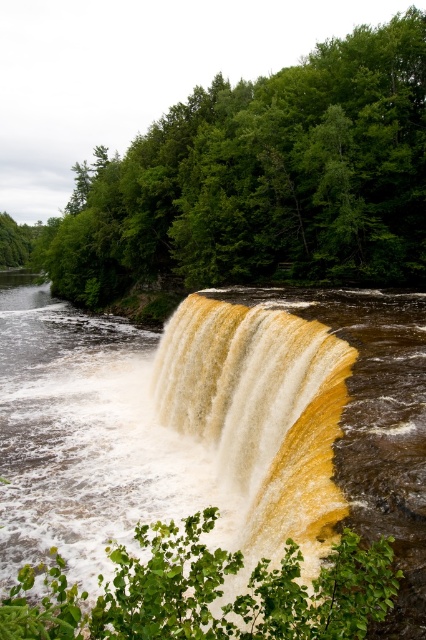
Question: Estimate the real-world distances between objects in this image. Which object is closer to the yellowish water at center?

Choices:
 (A) green leafy trees at center
 (B) brown textured waterfall at center

Answer: (B)

Question: Does brown textured waterfall at center come in front of green leafy trees at center?

Choices:
 (A) no
 (B) yes

Answer: (B)

Question: Does brown textured waterfall at center have a lesser width compared to yellowish water at center?

Choices:
 (A) yes
 (B) no

Answer: (B)

Question: Which object is positioned farthest from the brown textured waterfall at center?

Choices:
 (A) green leafy trees at center
 (B) yellowish water at center

Answer: (A)

Question: Is brown textured waterfall at center in front of yellowish water at center?

Choices:
 (A) yes
 (B) no

Answer: (A)

Question: Estimate the real-world distances between objects in this image. Which object is closer to the yellowish water at center?

Choices:
 (A) brown textured waterfall at center
 (B) green leafy trees at center

Answer: (A)